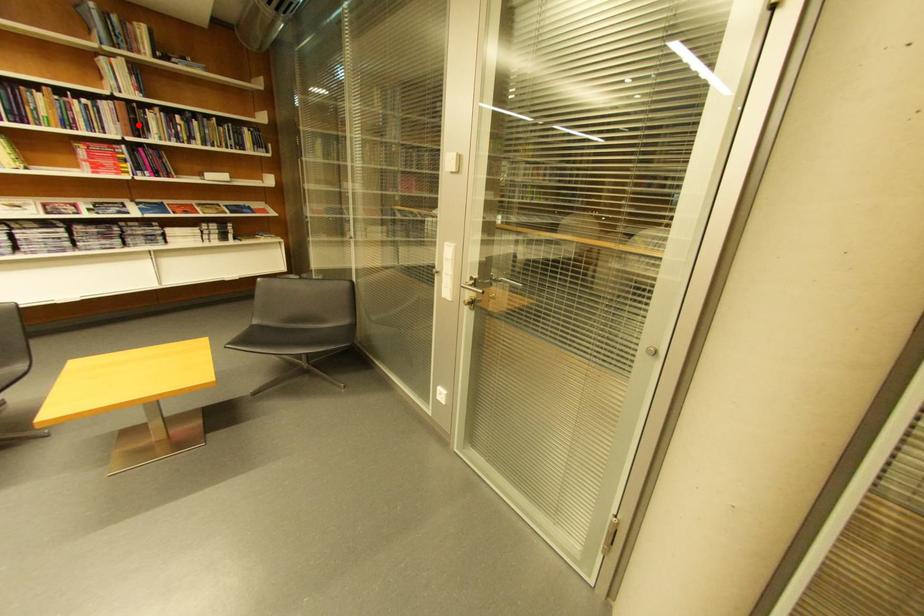
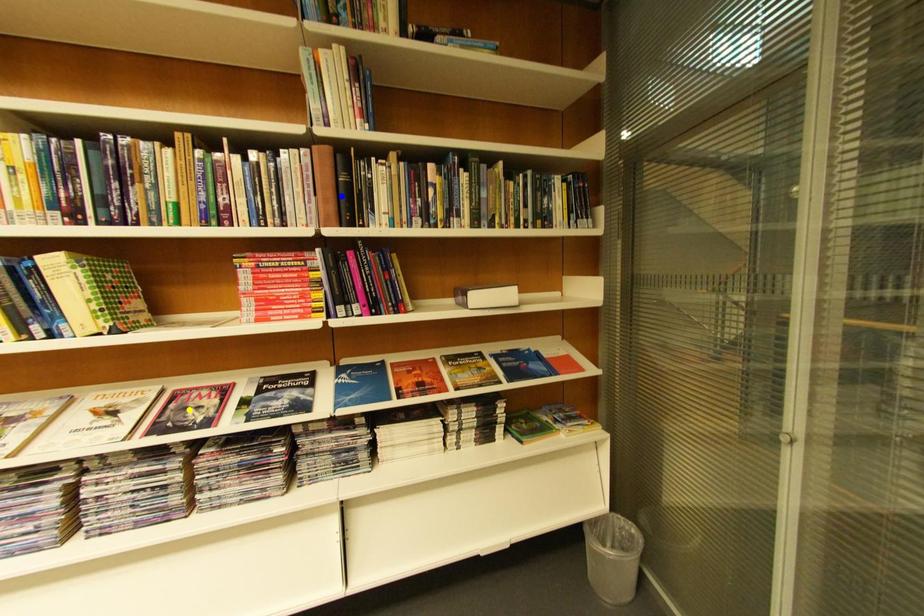
Question: I am providing you with two images of the same scene from different viewpoints. A red point is marked on the first image. You are given multiple points on the second image. In image 2, which mark is for the same physical point as the one in image 1?

Choices:
 (A) blue point
 (B) green point
 (C) yellow point

Answer: (A)